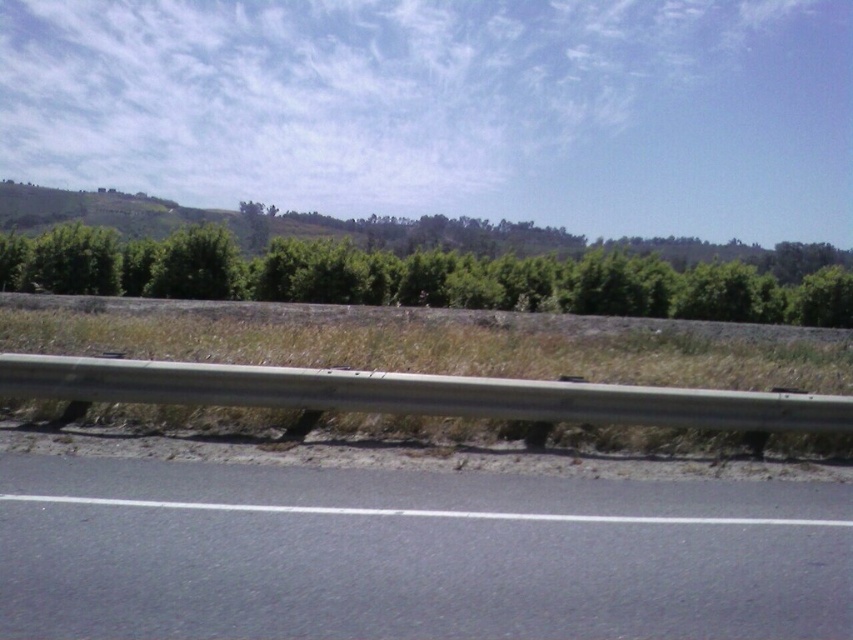
Question: Which object is farther from the camera taking this photo?

Choices:
 (A) green leafy trees at center
 (B) black asphalt road at lower center

Answer: (A)

Question: Among these objects, which one is farthest from the camera?

Choices:
 (A) green leafy trees at center
 (B) black asphalt road at lower center

Answer: (A)

Question: Which of the following is the farthest from the observer?

Choices:
 (A) (213, 573)
 (B) (451, 288)

Answer: (B)

Question: Does black asphalt road at lower center come behind green leafy trees at center?

Choices:
 (A) yes
 (B) no

Answer: (B)

Question: Can you confirm if black asphalt road at lower center is positioned above green leafy trees at center?

Choices:
 (A) yes
 (B) no

Answer: (B)

Question: Does black asphalt road at lower center have a greater width compared to green leafy trees at center?

Choices:
 (A) no
 (B) yes

Answer: (A)